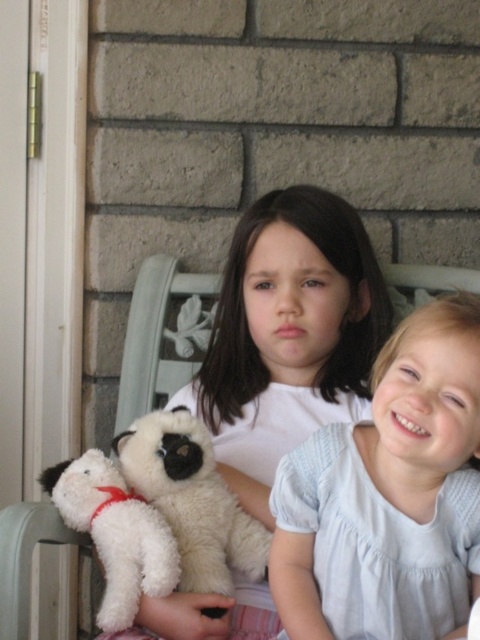
Which of these two, white cotton dress at center or white plush dog at center, stands taller?

With more height is white cotton dress at center.

Is point (409, 561) closer to camera compared to point (109, 586)?

Yes, point (409, 561) is closer to viewer.

The width and height of the screenshot is (480, 640). Identify the location of white cotton dress at center. (388, 496).